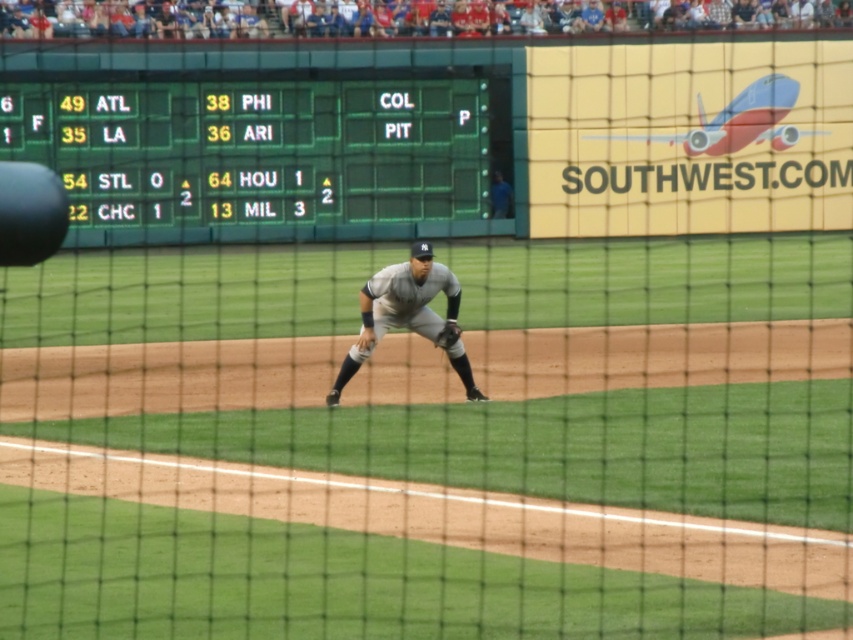
Can you confirm if green plastic scoreboard at upper left is positioned below dark brown leather glove at center?

No, green plastic scoreboard at upper left is not below dark brown leather glove at center.

Does green plastic scoreboard at upper left appear on the right side of dark brown leather glove at center?

No, green plastic scoreboard at upper left is not to the right of dark brown leather glove at center.

Identify the location of green plastic scoreboard at upper left. (257, 157).

Locate an element on the screen. This screenshot has height=640, width=853. green plastic scoreboard at upper left is located at coordinates (257, 157).

Which is above, green plastic scoreboard at upper left or gray uniformed baseball player at center?

Positioned higher is green plastic scoreboard at upper left.

Can you confirm if green plastic scoreboard at upper left is positioned to the left of gray uniformed baseball player at center?

Indeed, green plastic scoreboard at upper left is positioned on the left side of gray uniformed baseball player at center.

Locate an element on the screen. green plastic scoreboard at upper left is located at coordinates (257, 157).

Locate an element on the screen. Image resolution: width=853 pixels, height=640 pixels. green plastic scoreboard at upper left is located at coordinates (257, 157).

Is gray uniformed baseball player at center shorter than dark brown leather glove at center?

No.

Does gray uniformed baseball player at center appear over dark brown leather glove at center?

Yes.

Measure the distance between gray uniformed baseball player at center and camera.

gray uniformed baseball player at center and camera are 15.46 meters apart.

Find the location of a particular element. gray uniformed baseball player at center is located at coordinates (399, 307).